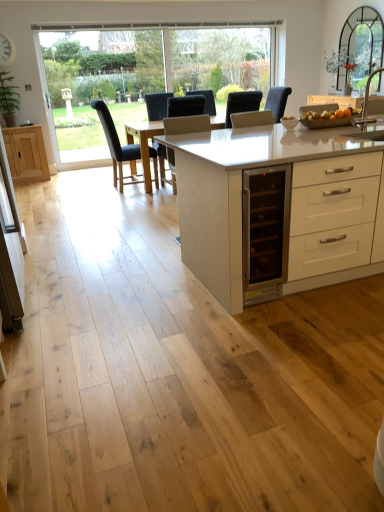
The height and width of the screenshot is (512, 384). In order to click on vacant area situated below silver metallic sink at right (from a real-world perspective) in this screenshot , I will do `click(369, 133)`.